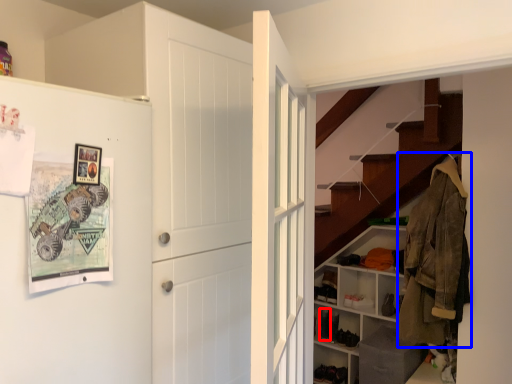
Question: Among these objects, which one is nearest to the camera, shoe (highlighted by a red box) or clothing (highlighted by a blue box)?

Choices:
 (A) shoe
 (B) clothing

Answer: (B)